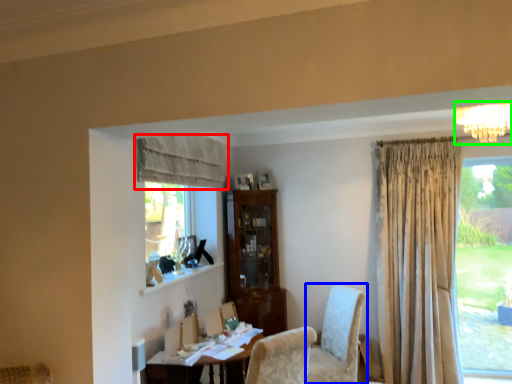
Question: Considering the real-world distances, which object is closest to curtain (highlighted by a red box)? chair (highlighted by a blue box) or light fixture (highlighted by a green box).

Choices:
 (A) chair
 (B) light fixture

Answer: (A)